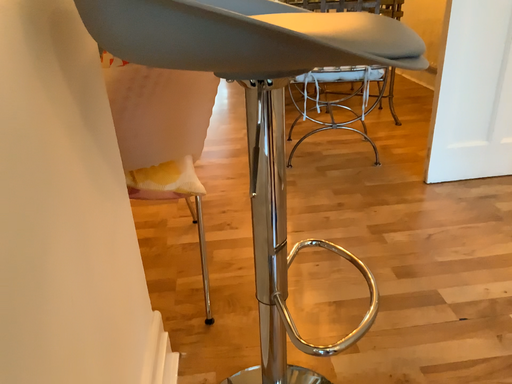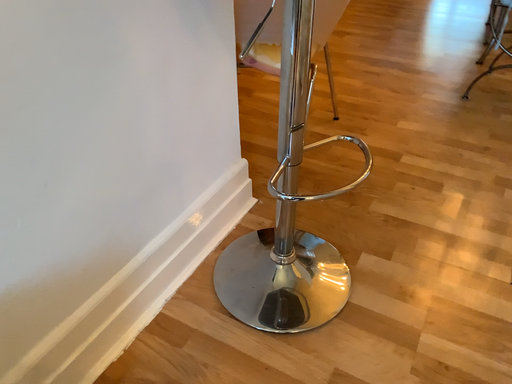
Question: How did the camera likely rotate when shooting the video?

Choices:
 (A) rotated right
 (B) rotated left

Answer: (B)